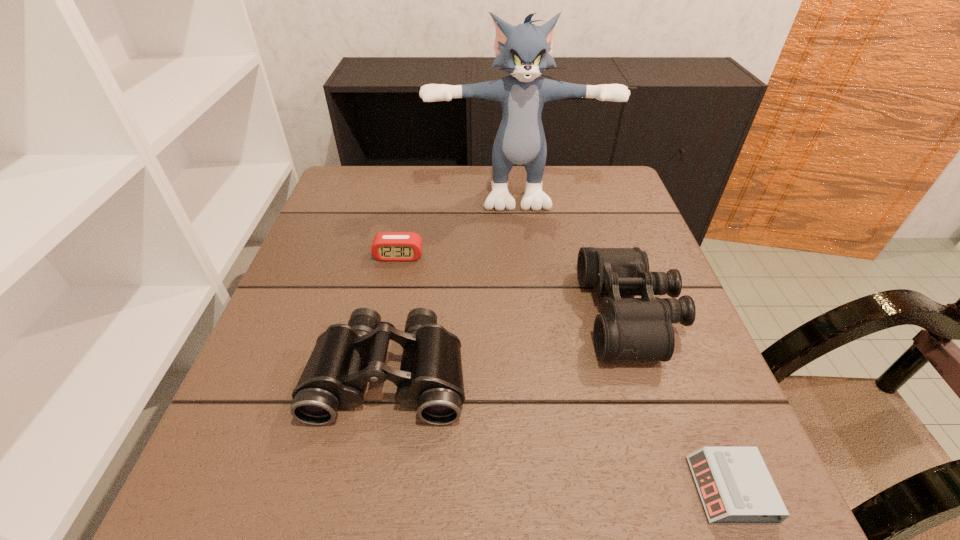
The height and width of the screenshot is (540, 960). I want to click on the tallest object, so click(525, 51).

Find the location of a particular element. This screenshot has width=960, height=540. cat is located at coordinates (525, 51).

The height and width of the screenshot is (540, 960). In order to click on the right binoculars in this screenshot , I will do tap(641, 328).

The height and width of the screenshot is (540, 960). I want to click on the left binoculars, so click(x=345, y=357).

Image resolution: width=960 pixels, height=540 pixels. What are the coordinates of `the taller alarm clock` in the screenshot? It's located at (387, 246).

You are a GUI agent. You are given a task and a screenshot of the screen. Output one action in this format:
    pyautogui.click(x=<x>, y=<y>)
    Task: Click on the left alarm clock
    This screenshot has width=960, height=540.
    Given the screenshot: What is the action you would take?
    pyautogui.click(x=387, y=246)

The image size is (960, 540). I want to click on the shorter alarm clock, so click(x=735, y=486).

Where is `the nearer alarm clock`? The height and width of the screenshot is (540, 960). the nearer alarm clock is located at coordinates (735, 486).

You are a GUI agent. You are given a task and a screenshot of the screen. Output one action in this format:
    pyautogui.click(x=<x>, y=<y>)
    Task: Click on the blank space located on the front-facing side of the tallest object
    This screenshot has width=960, height=540.
    Given the screenshot: What is the action you would take?
    pyautogui.click(x=530, y=320)

Identify the location of vacant region located 0.120m at the eyepieces of the right binoculars. The width and height of the screenshot is (960, 540). pyautogui.click(x=527, y=314).